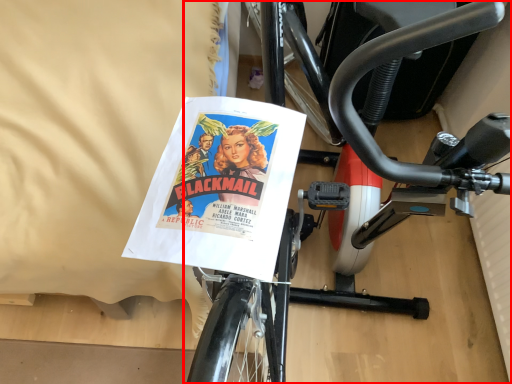
Question: From the image's perspective, where is bicycle (annotated by the red box) located relative to sheet?

Choices:
 (A) below
 (B) above

Answer: (A)